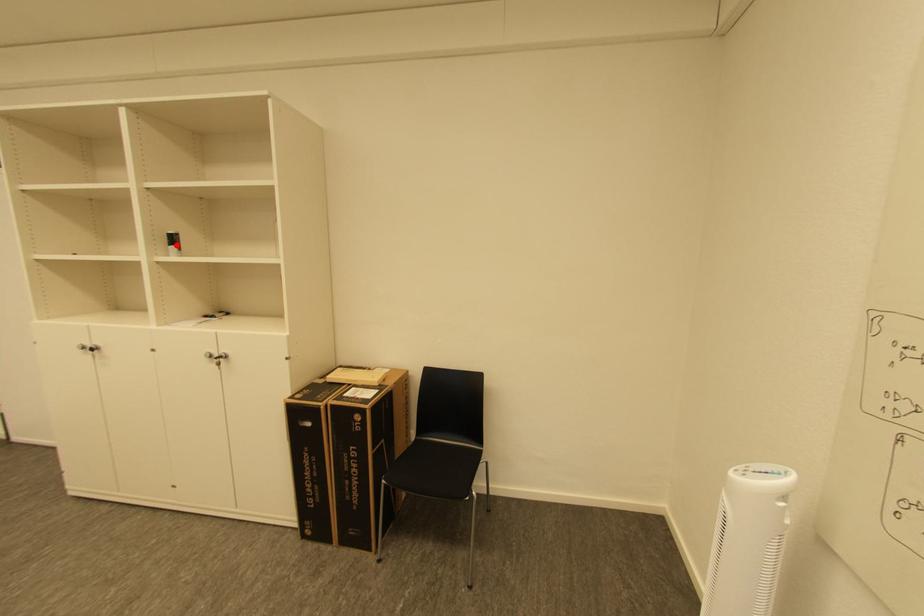
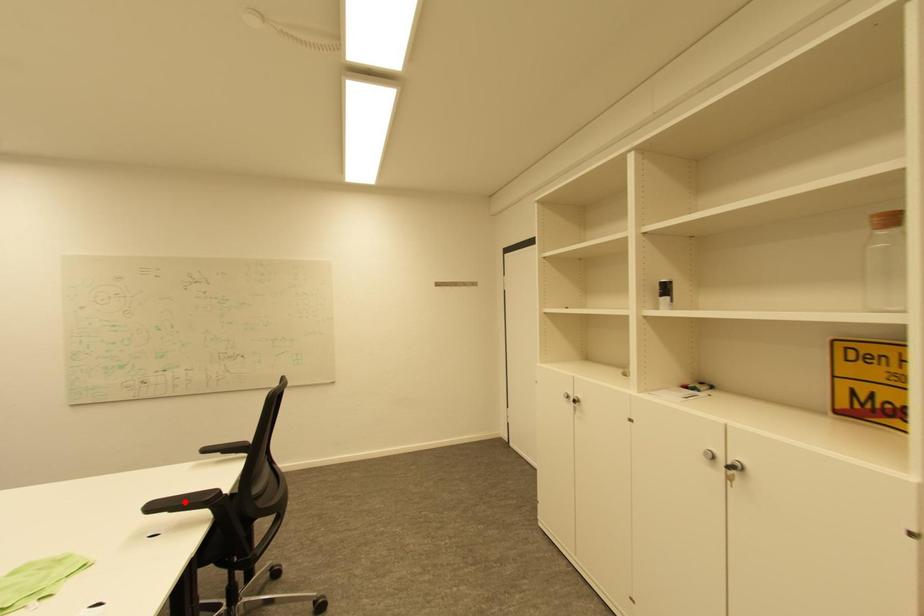
I am providing you with two images of the same scene from different viewpoints. A red point is marked on the first image and another point is marked on the second image. Are the points marked in image1 and image2 representing the same 3D position?

No